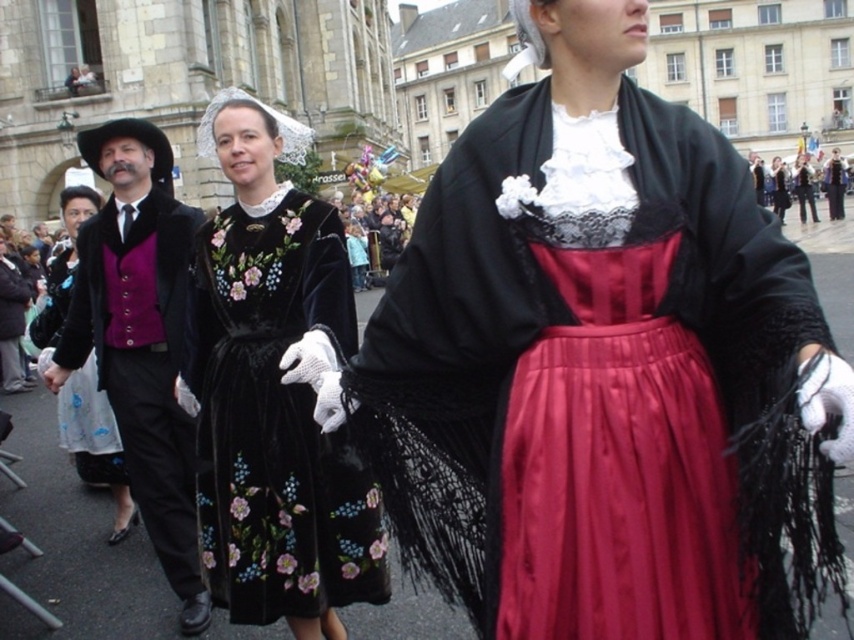
You are a photographer trying to capture the cultural parade scene. You notice two purple velvet vests in the image. Which one is positioned closer to you, the velvet purple vest at left or the purple velvet vest at left?

The velvet purple vest at left is closer to the viewer than the purple velvet vest at left.

You are standing at the starting point of the parade route. You see two points marked on the ground at point (127, 264) and point (126, 497). Which point is closer to you?

Point (127, 264) is in front of point (126, 497), so it is closer to you.

You are observing a parade scene and notice two people wearing purple vests. The first is labeled as the velvet purple vest at left, and the second as the purple velvet vest at left. Which of these two purple vests is positioned more to the right?

The velvet purple vest at left is positioned more to the right compared to the purple velvet vest at left, as it is on the right side of the latter.